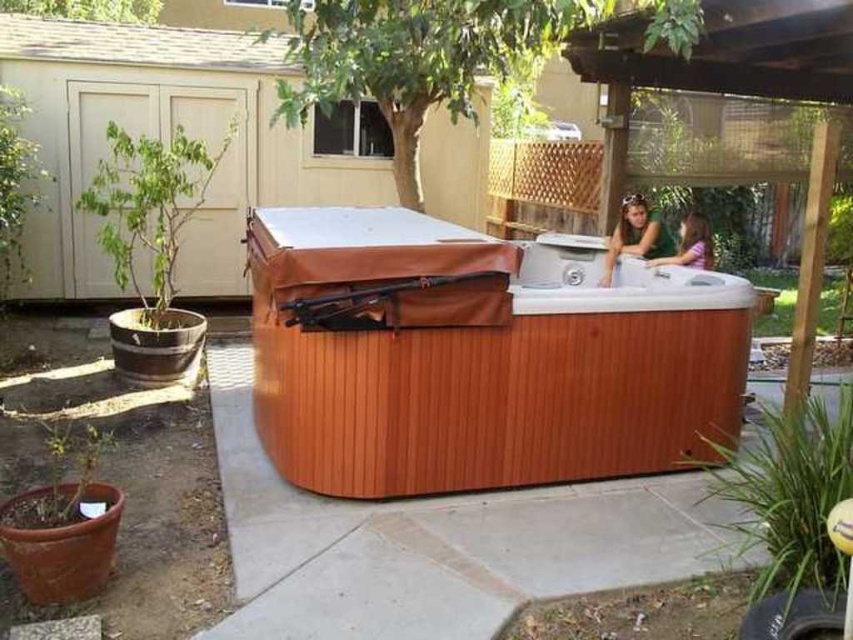
Measure the distance between wooden hot tub at center and matte brown hot tub at upper right.

wooden hot tub at center and matte brown hot tub at upper right are 5.49 feet apart from each other.

Can you confirm if wooden hot tub at center is wider than matte brown hot tub at upper right?

Yes, wooden hot tub at center is wider than matte brown hot tub at upper right.

This screenshot has width=853, height=640. What do you see at coordinates (477, 356) in the screenshot?
I see `wooden hot tub at center` at bounding box center [477, 356].

In order to click on wooden hot tub at center in this screenshot , I will do `click(477, 356)`.

Which is more to the right, matte brown hair at upper right or matte brown hot tub at upper right?

matte brown hot tub at upper right is more to the right.

Can you confirm if matte brown hair at upper right is shorter than matte brown hot tub at upper right?

Incorrect, matte brown hair at upper right's height does not fall short of matte brown hot tub at upper right's.

Locate an element on the screen. Image resolution: width=853 pixels, height=640 pixels. matte brown hair at upper right is located at coordinates (635, 236).

Who is lower down, wooden hot tub at center or matte brown hair at upper right?

wooden hot tub at center is lower down.

Does wooden hot tub at center have a larger size compared to matte brown hair at upper right?

Correct, wooden hot tub at center is larger in size than matte brown hair at upper right.

The height and width of the screenshot is (640, 853). Identify the location of wooden hot tub at center. (477, 356).